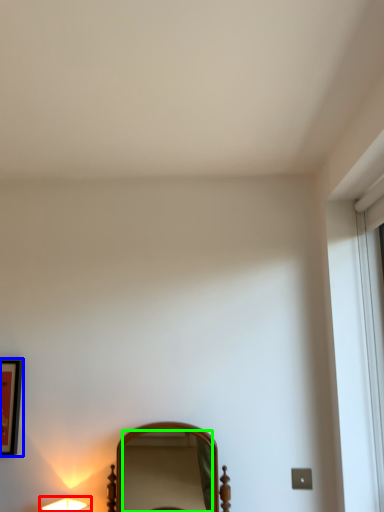
Question: Considering the real-world distances, which object is farthest from lamp (highlighted by a red box)? picture frame (highlighted by a blue box) or mirror (highlighted by a green box)?

Choices:
 (A) picture frame
 (B) mirror

Answer: (B)